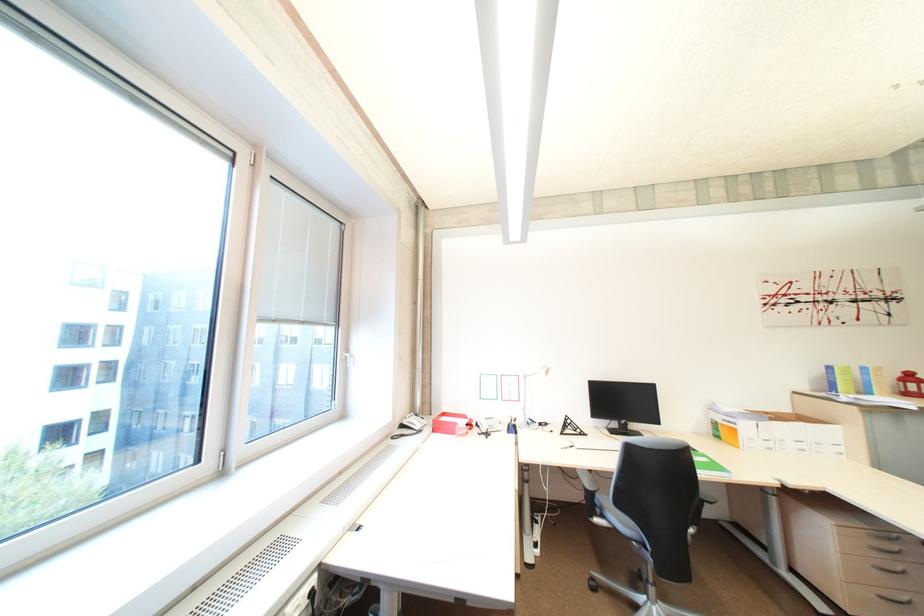
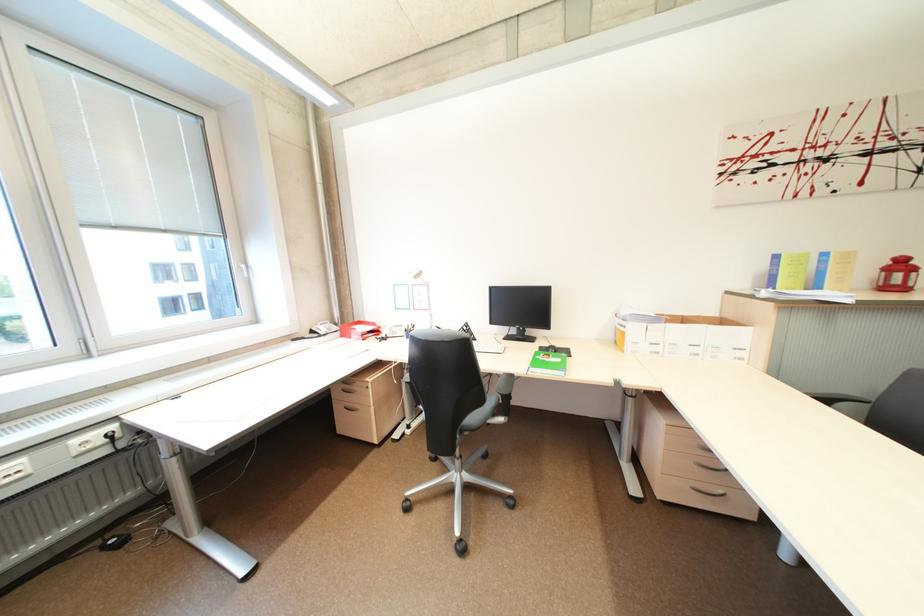
Where in the second image is the point corresponding to point (745, 431) from the first image?

(633, 334)